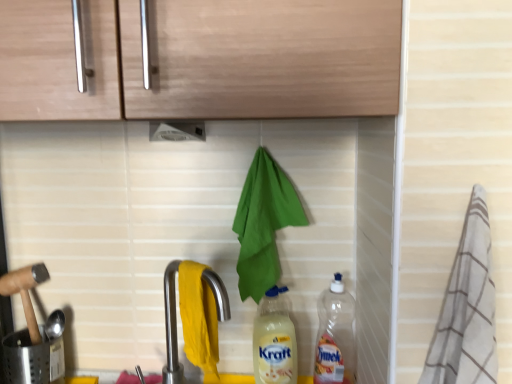
Question: From a real-world perspective, is white plastic exhaust hood at upper center over satin nickel faucet at lower center?

Choices:
 (A) yes
 (B) no

Answer: (A)

Question: Considering the relative sizes of white plastic exhaust hood at upper center and satin nickel faucet at lower center in the image provided, is white plastic exhaust hood at upper center thinner than satin nickel faucet at lower center?

Choices:
 (A) no
 (B) yes

Answer: (A)

Question: Does white plastic exhaust hood at upper center have a lesser height compared to satin nickel faucet at lower center?

Choices:
 (A) no
 (B) yes

Answer: (B)

Question: Is white plastic exhaust hood at upper center at the right side of satin nickel faucet at lower center?

Choices:
 (A) no
 (B) yes

Answer: (A)

Question: Is white plastic exhaust hood at upper center positioned beyond the bounds of satin nickel faucet at lower center?

Choices:
 (A) no
 (B) yes

Answer: (B)

Question: Would you say matte plastic bottle at center, which is the 1th bottle from left to right, is to the left or to the right of white plastic exhaust hood at upper center in the picture?

Choices:
 (A) left
 (B) right

Answer: (B)

Question: From a real-world perspective, is matte plastic bottle at center, which is the 1th bottle from left to right, physically located above or below white plastic exhaust hood at upper center?

Choices:
 (A) above
 (B) below

Answer: (B)

Question: Is point (256, 375) closer or farther from the camera than point (181, 130)?

Choices:
 (A) farther
 (B) closer

Answer: (A)

Question: In terms of size, does matte plastic bottle at center, which is the 1th bottle from left to right, appear bigger or smaller than white plastic exhaust hood at upper center?

Choices:
 (A) small
 (B) big

Answer: (B)

Question: In terms of height, does white striped towel at right look taller or shorter compared to transparent plastic bottle at lower right, placed as the first bottle when sorted from right to left?

Choices:
 (A) tall
 (B) short

Answer: (A)

Question: From the image's perspective, is white striped towel at right located above or below transparent plastic bottle at lower right, placed as the first bottle when sorted from right to left?

Choices:
 (A) below
 (B) above

Answer: (B)

Question: Considering the positions of white striped towel at right and transparent plastic bottle at lower right, placed as the first bottle when sorted from right to left, in the image, is white striped towel at right wider or thinner than transparent plastic bottle at lower right, placed as the first bottle when sorted from right to left,?

Choices:
 (A) thin
 (B) wide

Answer: (B)

Question: Does point (456, 380) appear closer or farther from the camera than point (316, 364)?

Choices:
 (A) closer
 (B) farther

Answer: (A)

Question: Considering the positions of point (173, 125) and point (263, 334), is point (173, 125) closer or farther from the camera than point (263, 334)?

Choices:
 (A) closer
 (B) farther

Answer: (A)

Question: Do you think white plastic exhaust hood at upper center is within matte plastic bottle at center, which is the 1th bottle from left to right, or outside of it?

Choices:
 (A) outside
 (B) inside

Answer: (A)